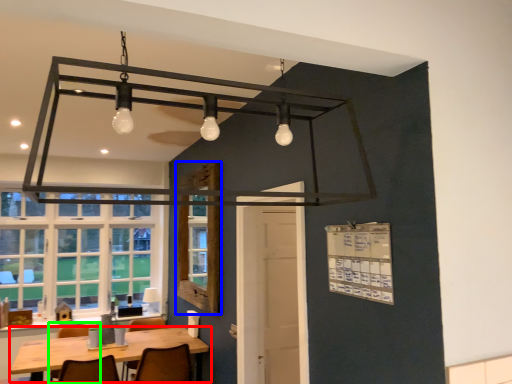
Question: Considering the real-world distances, which object is closest to table (highlighted by a red box)? window screen (highlighted by a blue box) or chair (highlighted by a green box).

Choices:
 (A) window screen
 (B) chair

Answer: (B)